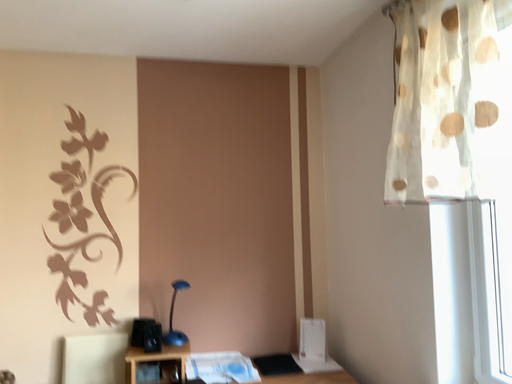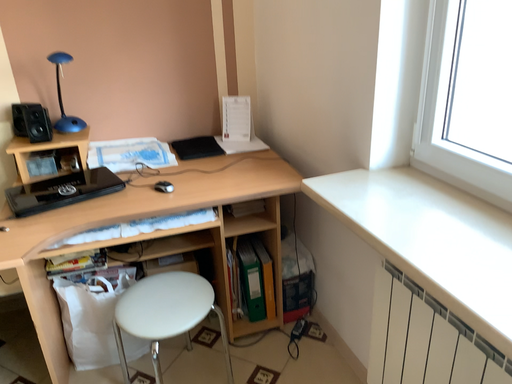
Question: How did the camera likely rotate when shooting the video?

Choices:
 (A) rotated upward
 (B) rotated downward

Answer: (B)